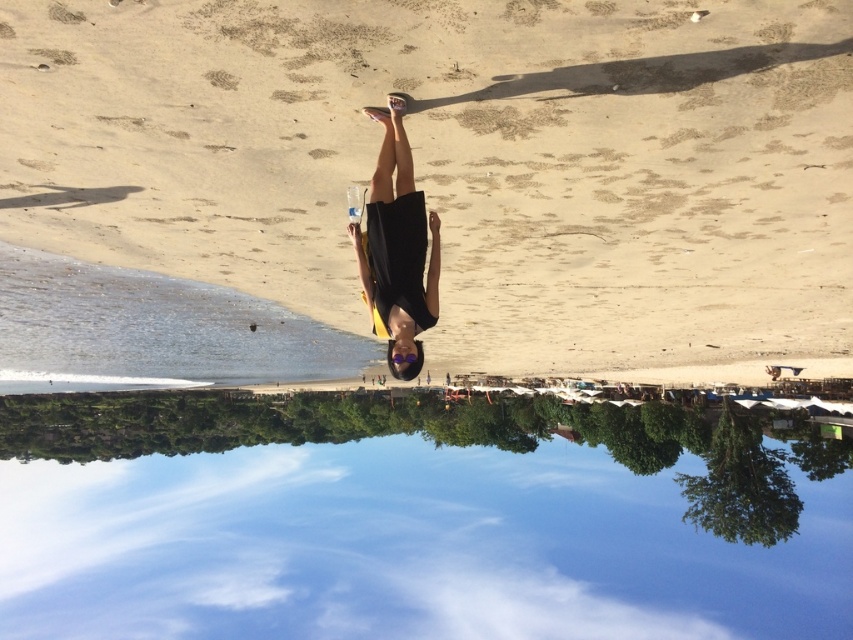
Question: Observing the image, what is the correct spatial positioning of beige sand at center in reference to transparent glass water at center?

Choices:
 (A) right
 (B) left

Answer: (A)

Question: In this image, where is beige sand at center located relative to transparent glass water at center?

Choices:
 (A) right
 (B) left

Answer: (A)

Question: Which of the following is the farthest from the observer?

Choices:
 (A) (805, 54)
 (B) (432, 321)
 (C) (820, 458)

Answer: (C)

Question: Which object appears farthest from the camera in this image?

Choices:
 (A) beige sand at center
 (B) transparent glass water at center
 (C) black matte dress at center

Answer: (B)

Question: Can you confirm if transparent glass water at center is smaller than black matte dress at center?

Choices:
 (A) no
 (B) yes

Answer: (A)

Question: Which point appears farthest from the camera in this image?

Choices:
 (A) (403, 225)
 (B) (189, 476)

Answer: (B)